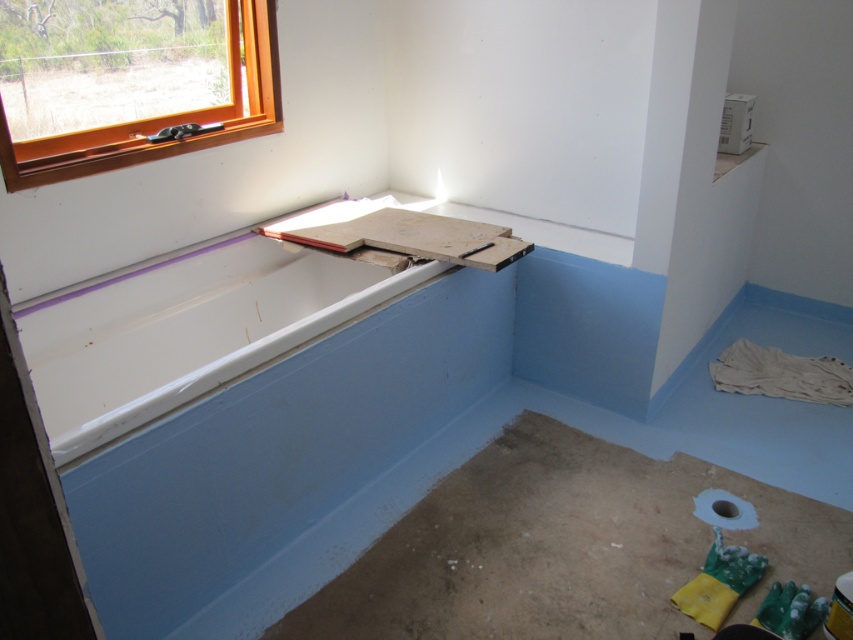
You are a contractor assessing the bathroom renovation. You need to determine if the white glossy bathtub at upper left can fit through the orange wood window at upper left to be removed. Can it fit based on their sizes?

The white glossy bathtub at upper left is bigger than orange wood window at upper left, so it cannot fit through the window.

You are a contractor assessing the bathroom renovation. You need to install a new fixture between the white glossy bathtub at upper left and the orange wood window at upper left. Based on their positions, which object is lower and should the fixture be placed above or below it?

The white glossy bathtub at upper left is below the orange wood window at upper left. Since the bathtub is lower, the fixture should be placed above it to avoid obstruction.